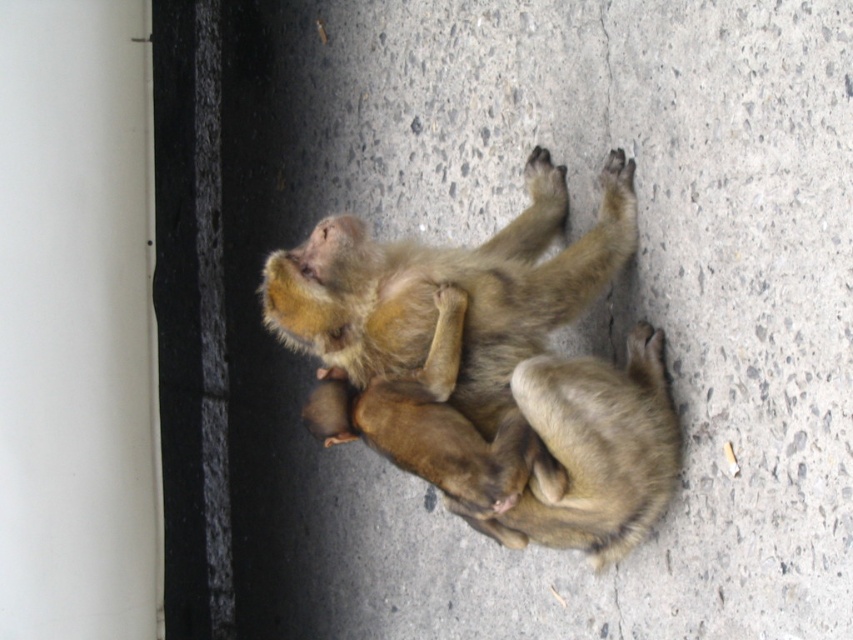
Question: Which object appears farthest from the camera in this image?

Choices:
 (A) fuzzy brown monkey at center
 (B) golden fur monkey at center
 (C) gray concrete at center

Answer: (B)

Question: Does gray concrete at center appear on the left side of fuzzy brown monkey at center?

Choices:
 (A) no
 (B) yes

Answer: (B)

Question: Which point is closer to the camera?

Choices:
 (A) gray concrete at center
 (B) fuzzy brown monkey at center
 (C) golden fur monkey at center

Answer: (A)

Question: Can you confirm if gray concrete at center is positioned to the left of golden fur monkey at center?

Choices:
 (A) no
 (B) yes

Answer: (B)

Question: Considering the real-world distances, which object is farthest from the golden fur monkey at center?

Choices:
 (A) fuzzy brown monkey at center
 (B) gray concrete at center

Answer: (B)

Question: Does gray concrete at center appear on the right side of golden fur monkey at center?

Choices:
 (A) yes
 (B) no

Answer: (B)